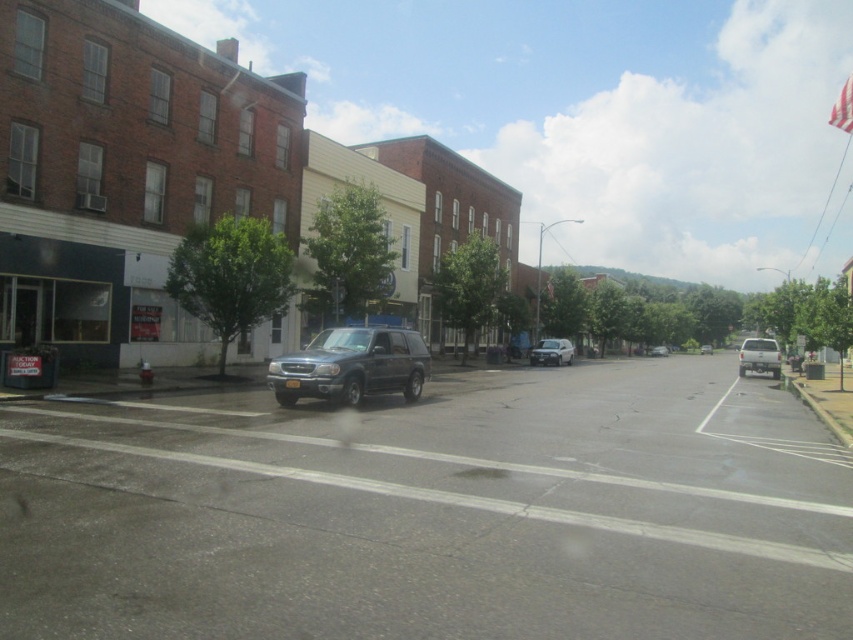
Does point (558, 355) come in front of point (666, 349)?

Yes.

Is point (556, 346) positioned after point (653, 348)?

No, it is not.

What are the coordinates of `white matte car at center` in the screenshot? It's located at (550, 353).

This screenshot has height=640, width=853. Describe the element at coordinates (550, 353) in the screenshot. I see `white matte car at center` at that location.

Image resolution: width=853 pixels, height=640 pixels. In order to click on white matte car at center in this screenshot , I will do [x=550, y=353].

Locate an element on the screen. The width and height of the screenshot is (853, 640). white matte car at center is located at coordinates (550, 353).

Does gray matte suv at center appear on the right side of white matte car at center?

In fact, gray matte suv at center is to the left of white matte car at center.

The width and height of the screenshot is (853, 640). Find the location of `gray matte suv at center`. gray matte suv at center is located at coordinates (432, 512).